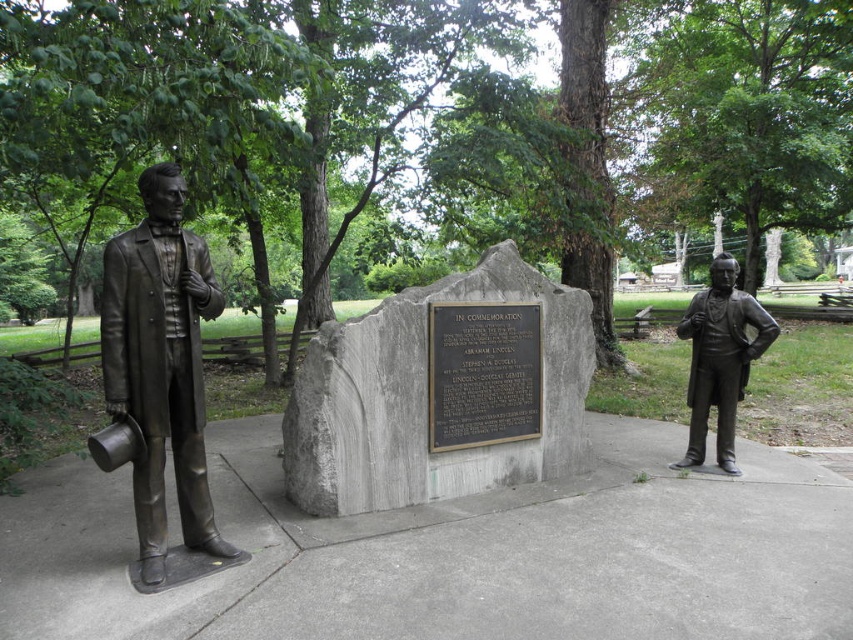
You are an art conservator assessing the space between the bronze statue at left and the black polished stone plaque at center. Based on their widths, which object takes up more horizontal space?

The black polished stone plaque at center has a greater width than the bronze statue at left, so it occupies more horizontal space.